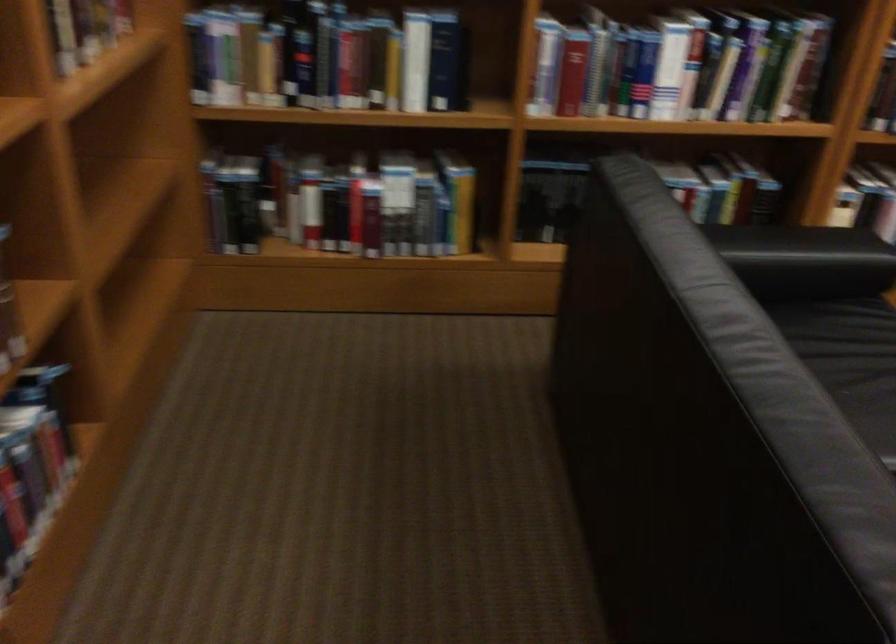
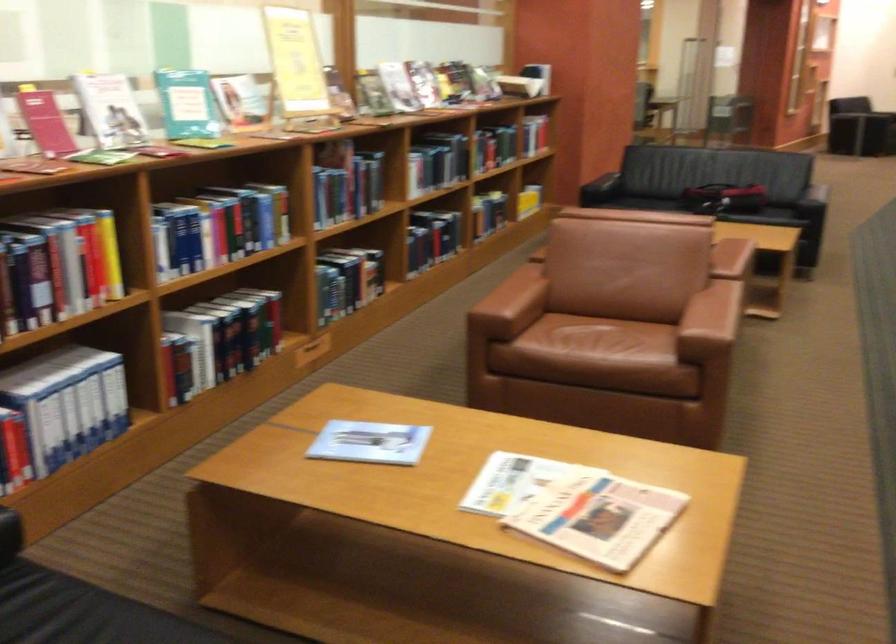
Question: The camera is either moving clockwise (left) or counter-clockwise (right) around the object. The first image is from the beginning of the video and the second image is from the end. Is the camera moving left or right when shooting the video?

Choices:
 (A) Left
 (B) Right

Answer: (A)